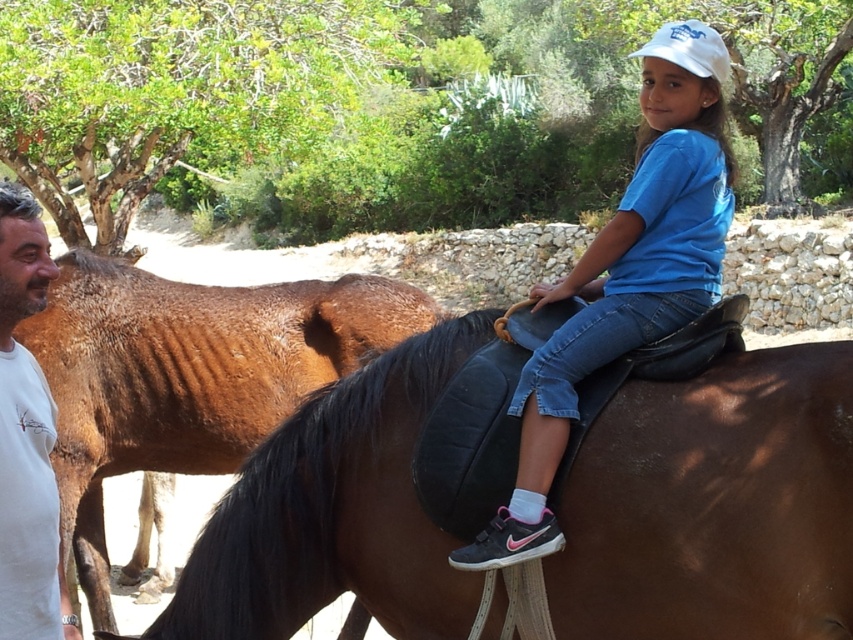
Who is more distant from viewer, (x=141, y=404) or (x=704, y=211)?

The point (x=141, y=404) is behind.

Does brown shiny horse at left have a lesser width compared to blue cotton shirt at center?

No.

Image resolution: width=853 pixels, height=640 pixels. What do you see at coordinates (189, 374) in the screenshot?
I see `brown shiny horse at left` at bounding box center [189, 374].

Find the location of `brown shiny horse at left`. brown shiny horse at left is located at coordinates (189, 374).

Describe the element at coordinates (189, 374) in the screenshot. Image resolution: width=853 pixels, height=640 pixels. I see `brown shiny horse at left` at that location.

Does brown shiny horse at left appear on the left side of white cotton shirt at left?

Correct, you'll find brown shiny horse at left to the left of white cotton shirt at left.

Is point (82, 573) farther from viewer compared to point (51, 588)?

Yes.

This screenshot has width=853, height=640. What are the coordinates of `brown shiny horse at left` in the screenshot? It's located at (189, 374).

Between brown leather saddle at upper center and brown shiny horse at left, which one is positioned higher?

brown shiny horse at left is above.

Locate an element on the screen. The height and width of the screenshot is (640, 853). brown leather saddle at upper center is located at coordinates point(714,506).